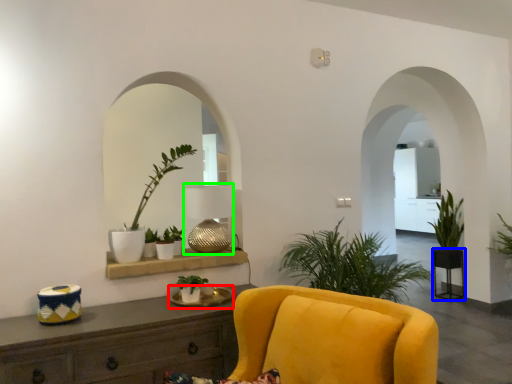
Question: Which is farther away from round table (highlighted by a red box)? round table (highlighted by a blue box) or lamp (highlighted by a green box)?

Choices:
 (A) round table
 (B) lamp

Answer: (A)